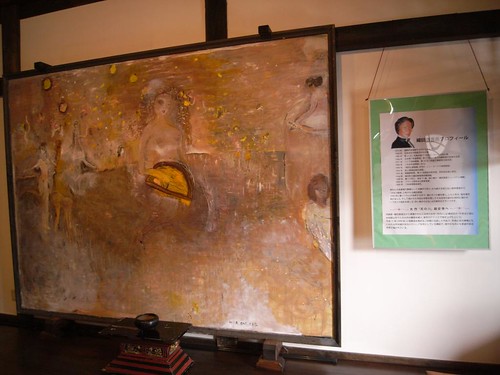
You are a GUI agent. You are given a task and a screenshot of the screen. Output one action in this format:
    pyautogui.click(x=<x>, y=<y>)
    Task: Click on the bracket holding picture
    The height and width of the screenshot is (375, 500).
    Given the screenshot: What is the action you would take?
    pyautogui.click(x=266, y=27), pyautogui.click(x=39, y=64)